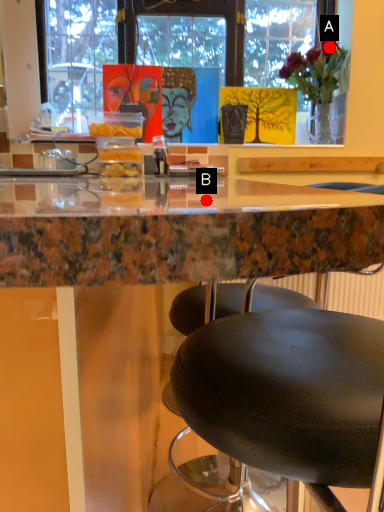
Question: Two points are circled on the image, labeled by A and B beside each circle. Which point is farther from the camera taking this photo?

Choices:
 (A) A is further
 (B) B is further

Answer: (A)